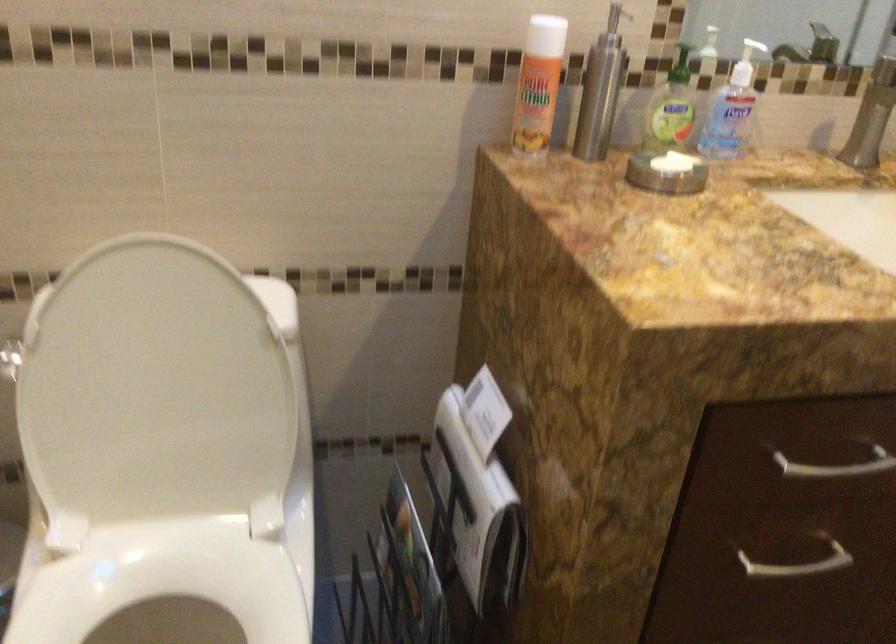
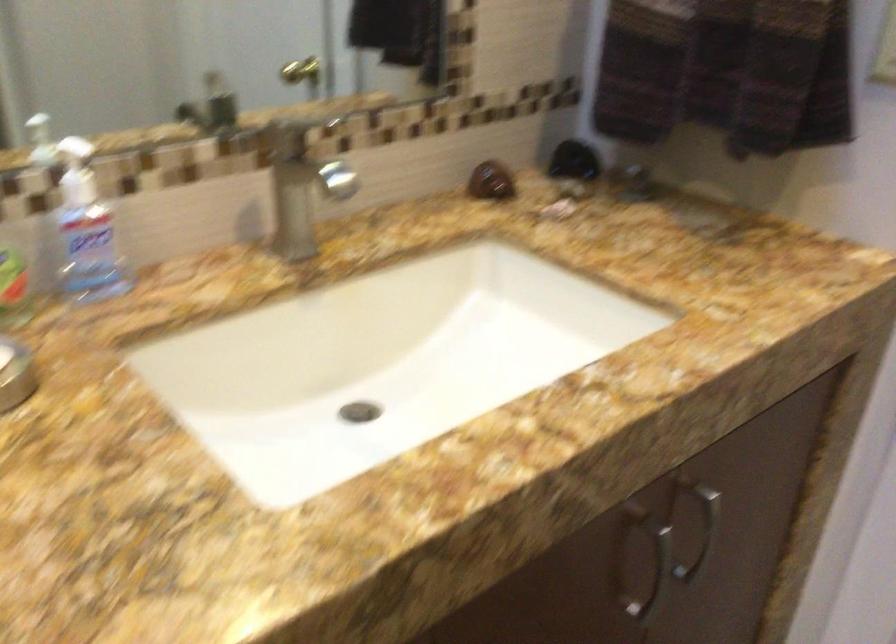
In a continuous first-person perspective shot, in which direction is the camera moving?

The cameraman walked toward right, forward.